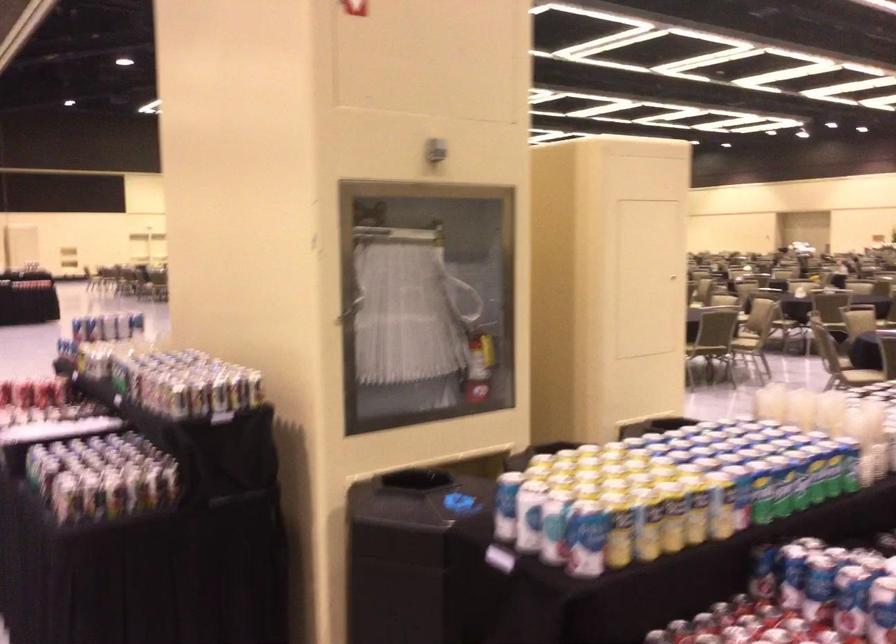
Where would you discard the trash can opening? Please return your answer as a coordinate pair (x, y).

(442, 502)